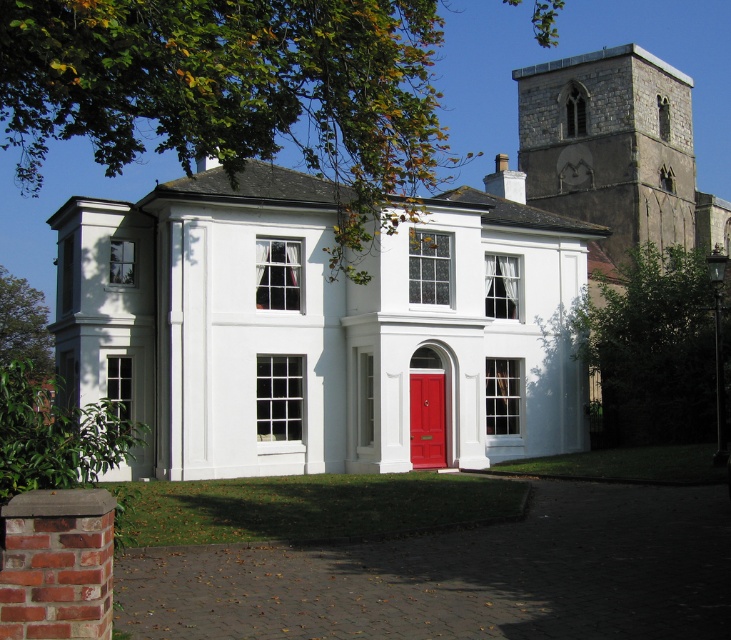
You are standing at the front entrance of the two story white building and want to know the location of the stone tower at upper right. Can you determine its position relative to the building?

The stone tower at upper right is located at point (376, 291) relative to the building.